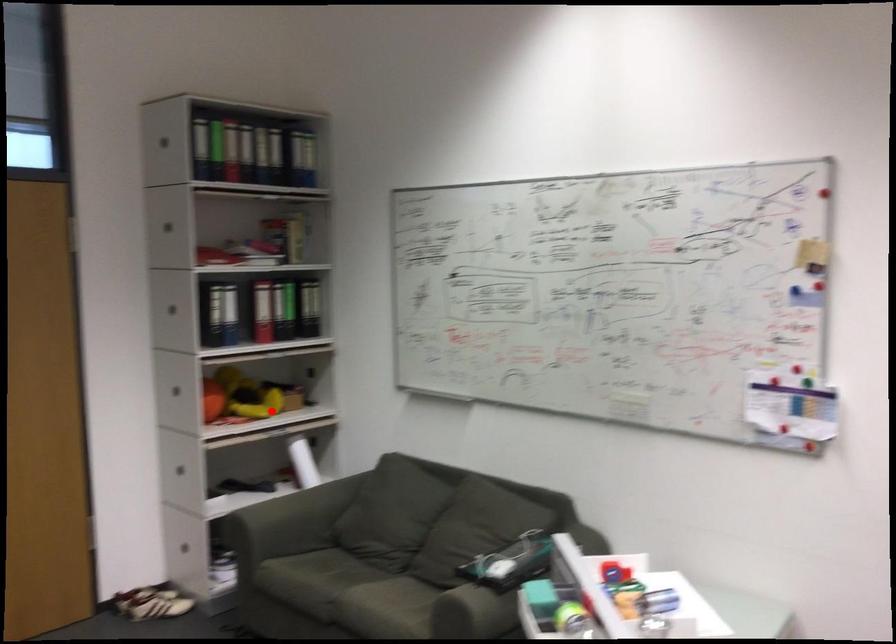
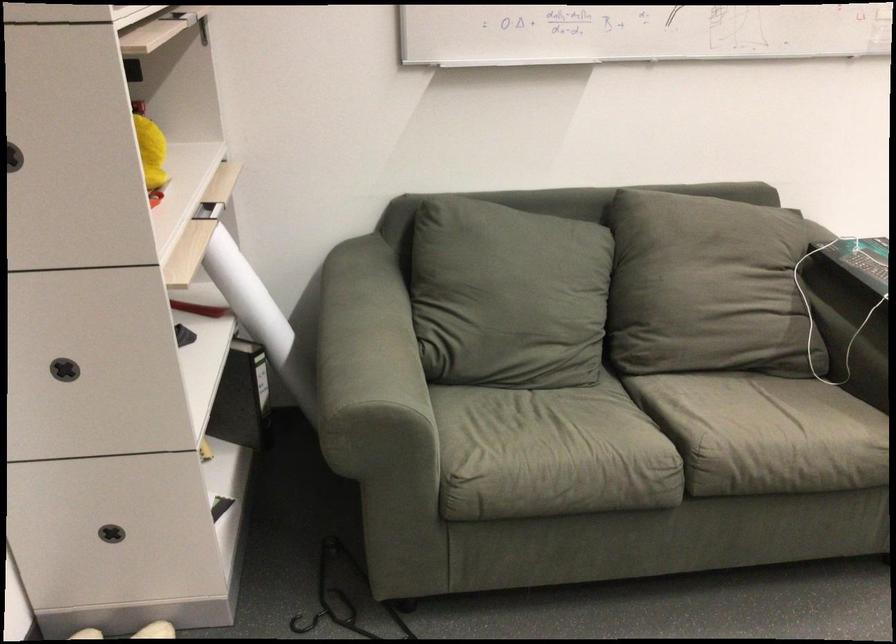
Question: I am providing you with two images of the same scene from different viewpoints. In image1, a red point is highlighted. Considering the same 3D point in image2, which of the following is correct?

Choices:
 (A) It is closer
 (B) It is farther

Answer: (A)